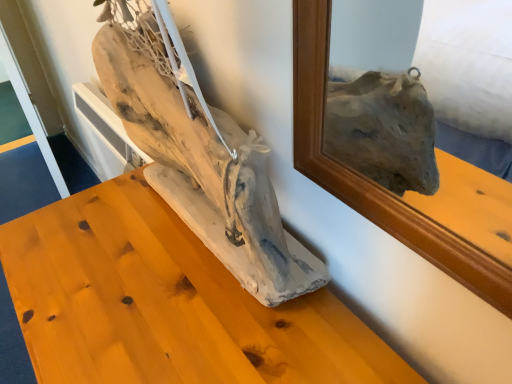
Identify the location of vacant space in front of natural wood driftwood at center. (177, 326).